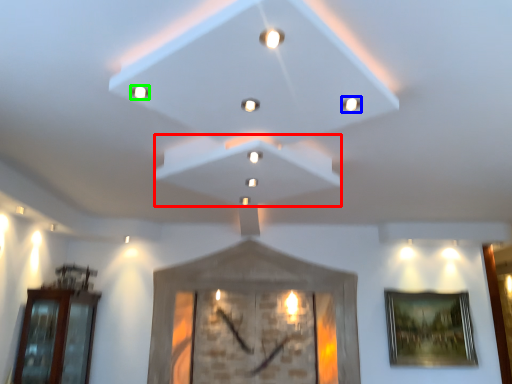
Question: Which object is positioned farthest from exhaust hood (highlighted by a red box)? Select from light (highlighted by a blue box) and light (highlighted by a green box).

Choices:
 (A) light
 (B) light

Answer: (B)